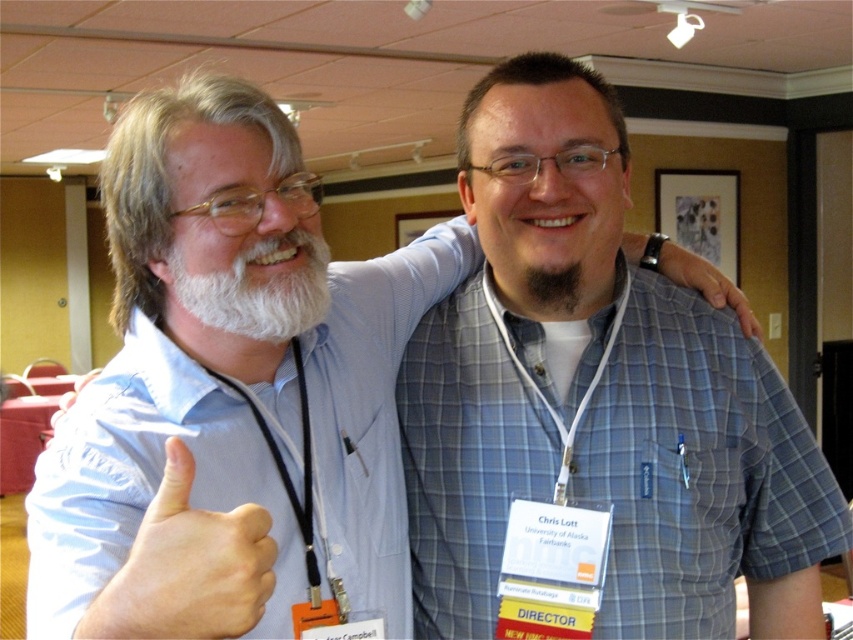
Question: Which of these objects is positioned farthest from the whitewoollybeard at left?

Choices:
 (A) dark brown fuzzy beard at center
 (B) blue plaid shirt at center

Answer: (B)

Question: Which point is farther from the camera taking this photo?

Choices:
 (A) (306, 246)
 (B) (422, 330)

Answer: (B)

Question: Observing the image, what is the correct spatial positioning of whitewoollybeard at left in reference to blue plaid shirt at upper center?

Choices:
 (A) right
 (B) left

Answer: (B)

Question: Does whitewoollybeard at left appear under dark brown fuzzy beard at center?

Choices:
 (A) no
 (B) yes

Answer: (A)

Question: Is skinny white hand at center above dark brown fuzzy beard at center?

Choices:
 (A) yes
 (B) no

Answer: (B)

Question: Which point is farther from the camera taking this photo?

Choices:
 (A) (262, 292)
 (B) (566, 296)
 (C) (140, 564)

Answer: (B)